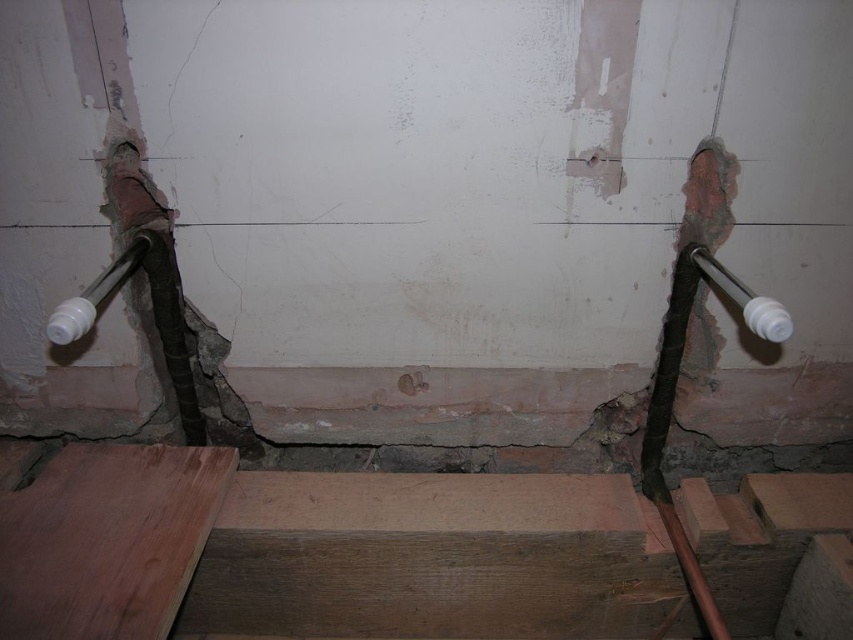
You are a construction worker inspecting the wall. You notice a point at coordinates (94, 294). Based on the scene, what object is this point located on?

The point is located on the white plastic pipe at left.